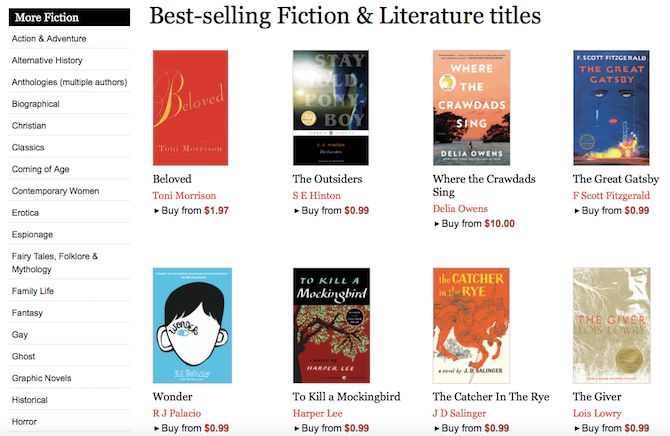
Locate an element on the screen. book covers is located at coordinates (191, 93), (340, 96), (460, 104), (624, 117), (618, 284), (474, 292), (331, 302), (191, 309).